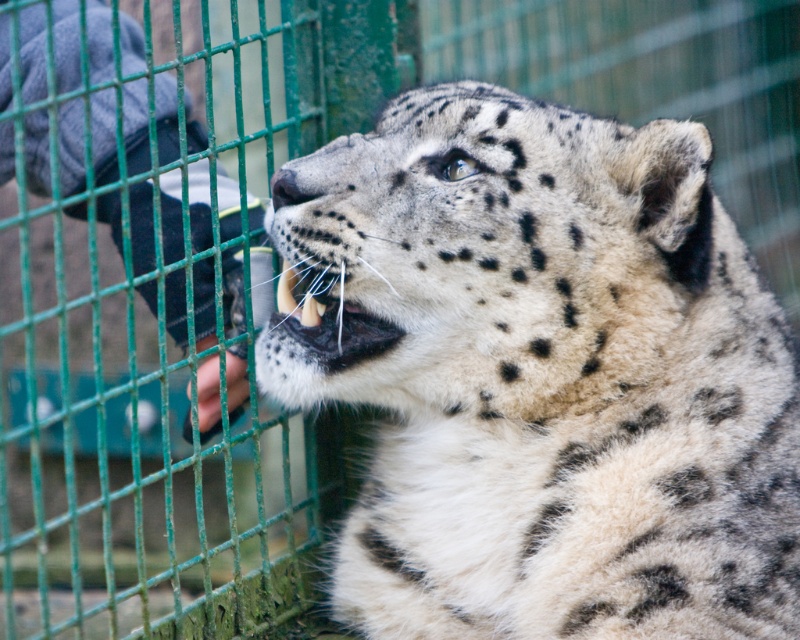
You are a zookeeper observing the spotted fur cheetah at center and the denim glove at left. Which object is nearer to you?

The spotted fur cheetah at center is closer to the viewer than the denim glove at left, so the spotted fur cheetah at center is nearer to you.

You are a zookeeper trying to identify the animals in the enclosure. You notice two animals at the center with the same fur color. Which one has a wider body? The spotted fur cheetah at center or the white fur at center?

The spotted fur cheetah at center has a larger width than the white fur at center, so the spotted fur cheetah at center has a wider body.

You are a zookeeper observing a snow leopard in its enclosure. You notice a point at coordinates (541, 376). What animal is located at that point?

The spotted fur cheetah at center is located at point (541, 376).